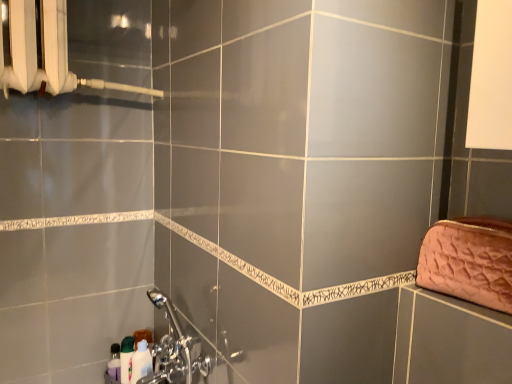
Question: From a real-world perspective, does translucent plastic bottle at lower left, the third toiletry positioned from the right, sit lower than pink quilted fabric clutch at right?

Choices:
 (A) yes
 (B) no

Answer: (A)

Question: Considering the relative sizes of translucent plastic bottle at lower left, the 1th toiletry in the left-to-right sequence, and pink quilted fabric clutch at right in the image provided, is translucent plastic bottle at lower left, the 1th toiletry in the left-to-right sequence, taller than pink quilted fabric clutch at right?

Choices:
 (A) yes
 (B) no

Answer: (A)

Question: Can you confirm if translucent plastic bottle at lower left, the 1th toiletry in the left-to-right sequence, is bigger than pink quilted fabric clutch at right?

Choices:
 (A) yes
 (B) no

Answer: (B)

Question: Is translucent plastic bottle at lower left, the third toiletry positioned from the right, to the right of pink quilted fabric clutch at right from the viewer's perspective?

Choices:
 (A) yes
 (B) no

Answer: (B)

Question: Does translucent plastic bottle at lower left, the 1th toiletry in the left-to-right sequence, contain pink quilted fabric clutch at right?

Choices:
 (A) no
 (B) yes

Answer: (A)

Question: Does translucent plastic bottle at lower left, the third toiletry positioned from the right, have a smaller size compared to pink quilted fabric clutch at right?

Choices:
 (A) yes
 (B) no

Answer: (A)

Question: Is chrome metallic faucet at lower left taller than white plastic radiator at upper left?

Choices:
 (A) yes
 (B) no

Answer: (B)

Question: Can you confirm if chrome metallic faucet at lower left is shorter than white plastic radiator at upper left?

Choices:
 (A) no
 (B) yes

Answer: (B)

Question: Does chrome metallic faucet at lower left appear on the right side of white plastic radiator at upper left?

Choices:
 (A) yes
 (B) no

Answer: (A)

Question: From a real-world perspective, is chrome metallic faucet at lower left below white plastic radiator at upper left?

Choices:
 (A) yes
 (B) no

Answer: (A)

Question: Considering the relative sizes of chrome metallic faucet at lower left and white plastic radiator at upper left in the image provided, is chrome metallic faucet at lower left smaller than white plastic radiator at upper left?

Choices:
 (A) yes
 (B) no

Answer: (A)

Question: Does chrome metallic faucet at lower left lie in front of white plastic radiator at upper left?

Choices:
 (A) yes
 (B) no

Answer: (B)

Question: Could you tell me if chrome metallic faucet at lower left is facing green glossy bottle at lower left, acting as the second toiletry starting from the right?

Choices:
 (A) no
 (B) yes

Answer: (A)